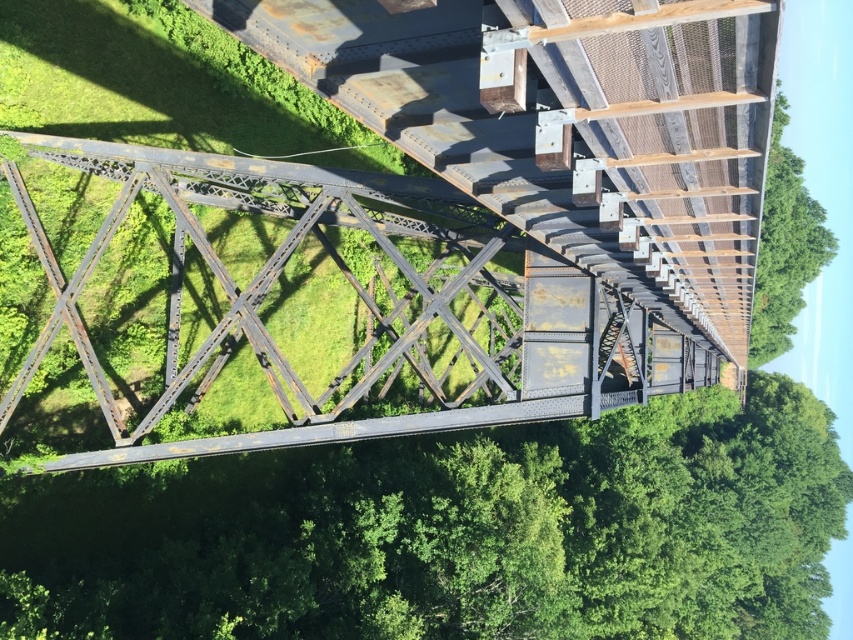
Question: Is green leafy tree at center positioned behind green leafy tree at upper right?

Choices:
 (A) no
 (B) yes

Answer: (B)

Question: Does green leafy tree at center have a larger size compared to green leafy tree at upper right?

Choices:
 (A) no
 (B) yes

Answer: (B)

Question: Among these objects, which one is farthest from the camera?

Choices:
 (A) green leafy tree at upper right
 (B) rusty metal bridge at center

Answer: (B)

Question: Does green leafy tree at center lie behind green leafy tree at upper right?

Choices:
 (A) yes
 (B) no

Answer: (A)

Question: Estimate the real-world distances between objects in this image. Which object is farther from the green leafy tree at center?

Choices:
 (A) rusty metal bridge at center
 (B) green leafy tree at upper right

Answer: (B)

Question: Which object is positioned farthest from the rusty metal bridge at center?

Choices:
 (A) green leafy tree at upper right
 (B) green leafy tree at center

Answer: (A)